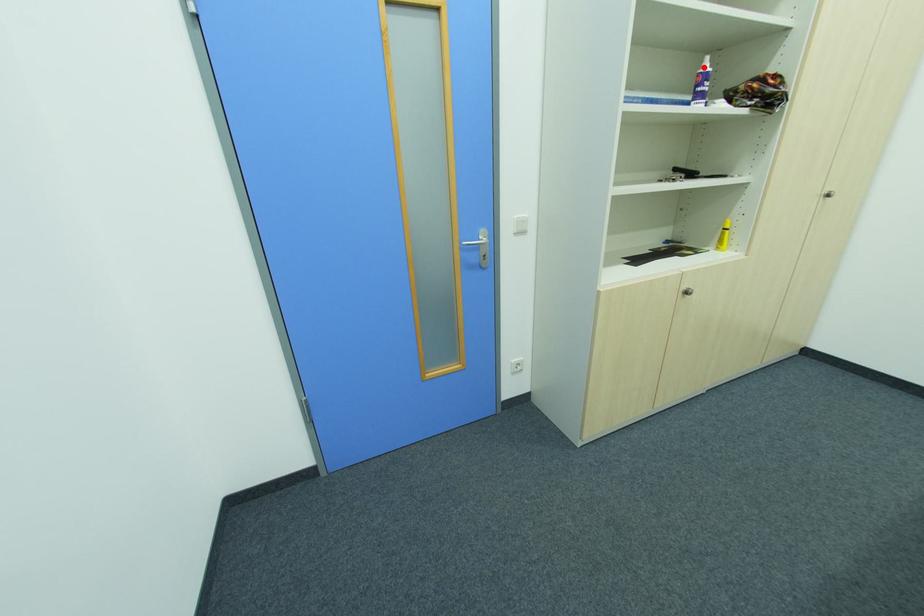
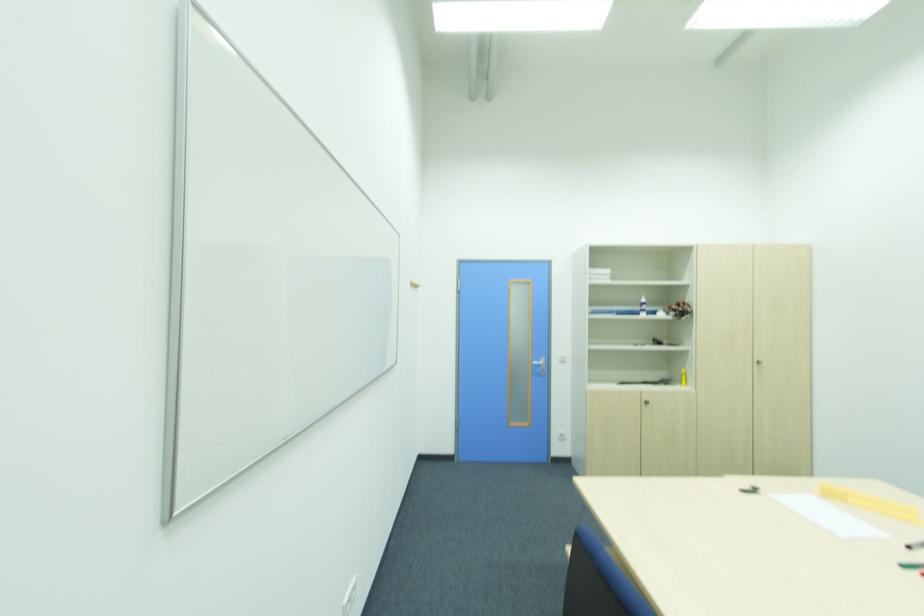
In the second image, find the point that corresponds to the highlighted location in the first image.

(643, 301)